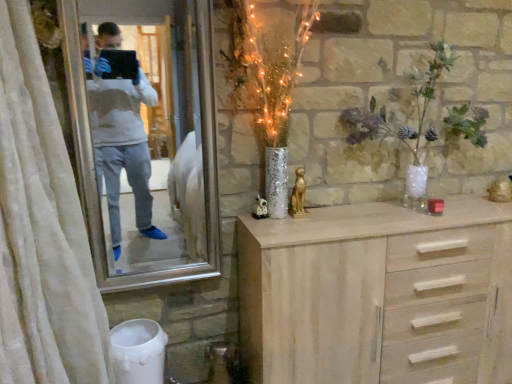
Question: Is point (446, 109) positioned closer to the camera than point (395, 334)?

Choices:
 (A) farther
 (B) closer

Answer: (A)

Question: Considering the positions of translucent glass vase at upper right and light wood chest of drawers at center in the image, is translucent glass vase at upper right bigger or smaller than light wood chest of drawers at center?

Choices:
 (A) big
 (B) small

Answer: (B)

Question: Based on their relative distances, which object is nearer to the white textured curtain at left?

Choices:
 (A) silver metallic mirror at upper left
 (B) light wood chest of drawers at center
 (C) translucent glass vase at upper right

Answer: (B)

Question: Considering the real-world distances, which object is closest to the silver metallic mirror at upper left?

Choices:
 (A) translucent glass vase at upper right
 (B) light wood chest of drawers at center
 (C) white textured curtain at left

Answer: (C)